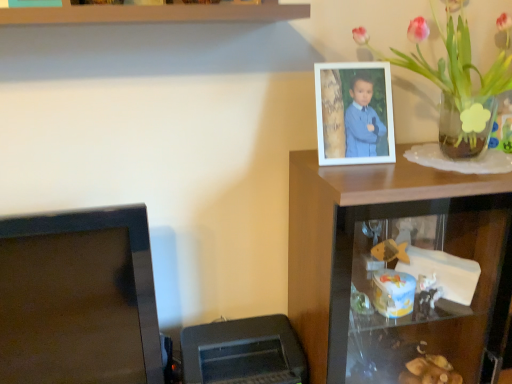
You are a GUI agent. You are given a task and a screenshot of the screen. Output one action in this format:
    pyautogui.click(x=<x>, y=<y>)
    Task: Click on the black plastic printer at lower left
    This screenshot has width=512, height=384.
    Given the screenshot: What is the action you would take?
    tap(243, 352)

Locate an element on the screen. white matte picture frame at upper right is located at coordinates (354, 113).

Locate an element on the screen. This screenshot has width=512, height=384. black plastic printer at lower left is located at coordinates (243, 352).

Is translucent glass vase at upper right not close to black plastic printer at lower left?

No, translucent glass vase at upper right is not far from black plastic printer at lower left.

From a real-world perspective, is translucent glass vase at upper right physically below black plastic printer at lower left?

No, from a real-world perspective, translucent glass vase at upper right is not below black plastic printer at lower left.

Measure the distance between translucent glass vase at upper right and black plastic printer at lower left.

translucent glass vase at upper right is 32.88 inches away from black plastic printer at lower left.

Is point (426, 78) more distant than point (204, 364)?

That is True.

Is black plastic printer at lower left beside satin black monitor at lower left?

black plastic printer at lower left is not next to satin black monitor at lower left, and they're not touching.

Is black plastic printer at lower left wider or thinner than satin black monitor at lower left?

In the image, black plastic printer at lower left appears to be wider than satin black monitor at lower left.

Considering the positions of point (203, 364) and point (68, 351), is point (203, 364) closer or farther from the camera than point (68, 351)?

Clearly, point (203, 364) is more distant from the camera than point (68, 351).

Does black plastic printer at lower left have a lesser height compared to satin black monitor at lower left?

Correct, black plastic printer at lower left is not as tall as satin black monitor at lower left.

Based on the photo, is the position of wooden shelf at upper right less distant than that of translucent glass vase at upper right?

No, it is not.

Is wooden shelf at upper right positioned with its back to translucent glass vase at upper right?

No, wooden shelf at upper right's orientation is not away from translucent glass vase at upper right.

Looking at this image, from a real-world perspective, between wooden shelf at upper right and translucent glass vase at upper right, who is vertically lower?

From a 3D spatial view, wooden shelf at upper right is below.

Is translucent glass vase at upper right bigger or smaller than white matte picture frame at upper right?

In the image, translucent glass vase at upper right appears to be larger than white matte picture frame at upper right.

In order to click on houseplant that appears on the right of white matte picture frame at upper right in this screenshot , I will do `click(455, 76)`.

Is white matte picture frame at upper right completely or partially inside translucent glass vase at upper right?

Indeed, white matte picture frame at upper right is located within translucent glass vase at upper right.

Considering the relative sizes of translucent glass vase at upper right and white matte picture frame at upper right in the image provided, is translucent glass vase at upper right shorter than white matte picture frame at upper right?

In fact, translucent glass vase at upper right may be taller than white matte picture frame at upper right.

Locate an element on the screen. picture frame on the left side of wooden shelf at upper right is located at coordinates 354,113.

In terms of size, does white matte picture frame at upper right appear bigger or smaller than wooden shelf at upper right?

Clearly, white matte picture frame at upper right is smaller in size than wooden shelf at upper right.

Considering the positions of objects white matte picture frame at upper right and wooden shelf at upper right in the image provided, who is more to the left, white matte picture frame at upper right or wooden shelf at upper right?

white matte picture frame at upper right.

Is white matte picture frame at upper right in front of or behind wooden shelf at upper right in the image?

Visually, white matte picture frame at upper right is located behind wooden shelf at upper right.

Consider the image. Would you say white matte picture frame at upper right is a long distance from satin black monitor at lower left?

They are positioned close to each other.

Is white matte picture frame at upper right aimed at satin black monitor at lower left?

No, white matte picture frame at upper right is not oriented towards satin black monitor at lower left.

Is white matte picture frame at upper right positioned behind satin black monitor at lower left?

Yes, it is.

Considering the sizes of white matte picture frame at upper right and satin black monitor at lower left in the image, is white matte picture frame at upper right taller or shorter than satin black monitor at lower left?

Clearly, white matte picture frame at upper right is shorter compared to satin black monitor at lower left.

Considering their positions, is satin black monitor at lower left located in front of or behind white matte picture frame at upper right?

Visually, satin black monitor at lower left is located in front of white matte picture frame at upper right.

Measure the distance between satin black monitor at lower left and white matte picture frame at upper right.

They are 26.43 inches apart.

How different are the orientations of satin black monitor at lower left and white matte picture frame at upper right in degrees?

6.32 degrees.

From a real-world perspective, is satin black monitor at lower left positioned under white matte picture frame at upper right based on gravity?

Yes.

Identify the location of houseplant above the black plastic printer at lower left (from a real-world perspective). This screenshot has width=512, height=384. (455, 76).

Locate an element on the screen. The width and height of the screenshot is (512, 384). appliance directly beneath the satin black monitor at lower left (from a real-world perspective) is located at coordinates (243, 352).

Consider the image. From the image, which object appears to be nearer to wooden shelf at upper right, black plastic printer at lower left or translucent glass vase at upper right?

black plastic printer at lower left is positioned closer to the anchor wooden shelf at upper right.

When comparing their distances from black plastic printer at lower left, does satin black monitor at lower left or translucent glass vase at upper right seem further?

translucent glass vase at upper right.

Consider the image. Estimate the real-world distances between objects in this image. Which object is further from wooden shelf at upper right, black plastic printer at lower left or white matte picture frame at upper right?

black plastic printer at lower left is positioned further to the anchor wooden shelf at upper right.

Looking at the image, which one is located further to wooden shelf at upper right, satin black monitor at lower left or translucent glass vase at upper right?

The object further to wooden shelf at upper right is satin black monitor at lower left.

When comparing their distances from translucent glass vase at upper right, does satin black monitor at lower left or white matte picture frame at upper right seem further?

Based on the image, satin black monitor at lower left appears to be further to translucent glass vase at upper right.

Considering their positions, is translucent glass vase at upper right positioned further to wooden shelf at upper right than white matte picture frame at upper right?

Among the two, translucent glass vase at upper right is located further to wooden shelf at upper right.

Estimate the real-world distances between objects in this image. Which object is further from white matte picture frame at upper right, translucent glass vase at upper right or satin black monitor at lower left?

satin black monitor at lower left lies further to white matte picture frame at upper right than the other object.

Considering their positions, is white matte picture frame at upper right positioned further to wooden shelf at upper right than satin black monitor at lower left?

Among the two, satin black monitor at lower left is located further to wooden shelf at upper right.

Where is `houseplant located between satin black monitor at lower left and wooden shelf at upper right in the left-right direction`? This screenshot has height=384, width=512. houseplant located between satin black monitor at lower left and wooden shelf at upper right in the left-right direction is located at coordinates (455, 76).

This screenshot has width=512, height=384. Identify the location of picture frame that lies between translucent glass vase at upper right and black plastic printer at lower left from top to bottom. (354, 113).

Locate an element on the screen. This screenshot has height=384, width=512. appliance between satin black monitor at lower left and wooden shelf at upper right is located at coordinates (243, 352).

Find the location of a particular element. picture frame between satin black monitor at lower left and translucent glass vase at upper right is located at coordinates (354, 113).